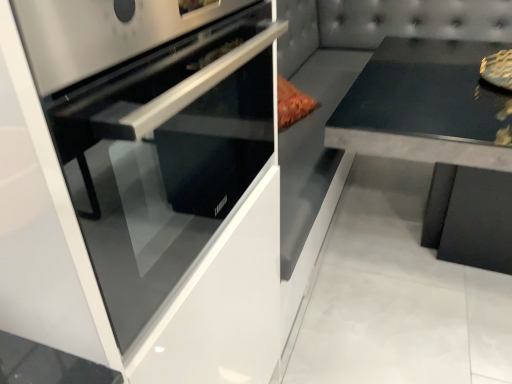
Question: Can you confirm if satin black oven at left is positioned to the left of black concrete table at right?

Choices:
 (A) no
 (B) yes

Answer: (B)

Question: Is satin black oven at left bigger than black concrete table at right?

Choices:
 (A) no
 (B) yes

Answer: (A)

Question: From the image's perspective, is satin black oven at left on black concrete table at right?

Choices:
 (A) no
 (B) yes

Answer: (A)

Question: Is satin black oven at left aimed at black concrete table at right?

Choices:
 (A) no
 (B) yes

Answer: (A)

Question: From the image's perspective, would you say satin black oven at left is shown under black concrete table at right?

Choices:
 (A) yes
 (B) no

Answer: (A)

Question: Is satin black oven at left turned away from black concrete table at right?

Choices:
 (A) yes
 (B) no

Answer: (B)

Question: Is black concrete table at right smaller than satin black oven at left?

Choices:
 (A) no
 (B) yes

Answer: (A)

Question: Can you confirm if black concrete table at right is positioned to the right of satin black oven at left?

Choices:
 (A) yes
 (B) no

Answer: (A)

Question: Is black concrete table at right positioned far away from satin black oven at left?

Choices:
 (A) no
 (B) yes

Answer: (A)

Question: Considering the relative positions of black concrete table at right and satin black oven at left in the image provided, is black concrete table at right in front of satin black oven at left?

Choices:
 (A) no
 (B) yes

Answer: (A)

Question: Is black concrete table at right not within satin black oven at left?

Choices:
 (A) no
 (B) yes

Answer: (B)

Question: Could you tell me if black concrete table at right is facing satin black oven at left?

Choices:
 (A) yes
 (B) no

Answer: (B)

Question: Is satin black oven at left in front of or behind black concrete table at right in the image?

Choices:
 (A) front
 (B) behind

Answer: (A)